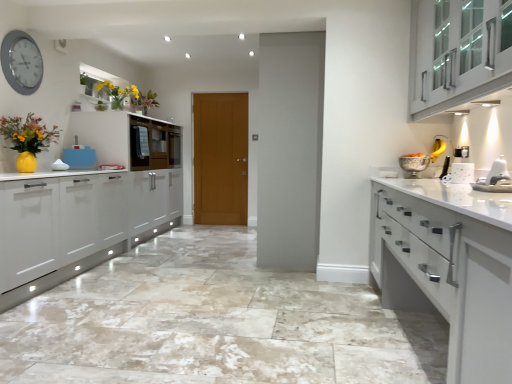
Question: From a real-world perspective, relative to white glossy cabinet at upper right, the second cabinetry when ordered from back to front, is white glossy cabinet at right, arranged as the third cabinetry when viewed from the back, vertically above or below?

Choices:
 (A) above
 (B) below

Answer: (B)

Question: Would you say white glossy cabinet at right, marked as the 1th cabinetry in a front-to-back arrangement, is to the left or to the right of white glossy cabinet at upper right, which is the second cabinetry from front to back, in the picture?

Choices:
 (A) right
 (B) left

Answer: (B)

Question: Based on their relative distances, which object is nearer to the matte glass vase at upper left, the first floral arrangement when ordered from back to front?

Choices:
 (A) matte yellow vase at left, which is the second floral arrangement from top to bottom
 (B) marble tile floor at center
 (C) white glossy microwave at upper left, placed as the 1th cabinetry when sorted from back to front
 (D) wooden door at center
 (E) white plastic toaster at right

Answer: (C)

Question: Which object is positioned farthest from the silver metallic clock at upper left?

Choices:
 (A) white glossy cabinet at right, arranged as the third cabinetry when viewed from the back
 (B) matte yellow vase at left, the 1th floral arrangement viewed from the left
 (C) white glossy microwave at upper left, which is counted as the 1th cabinetry, starting from the left
 (D) wooden door at center
 (E) white plastic toaster at right

Answer: (E)